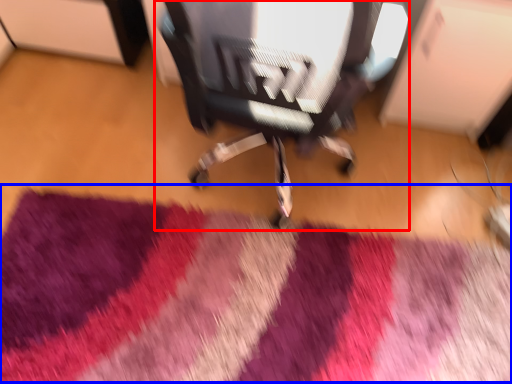
Question: Which object appears closest to the camera in this image, chair (highlighted by a red box) or mat (highlighted by a blue box)?

Choices:
 (A) chair
 (B) mat

Answer: (A)